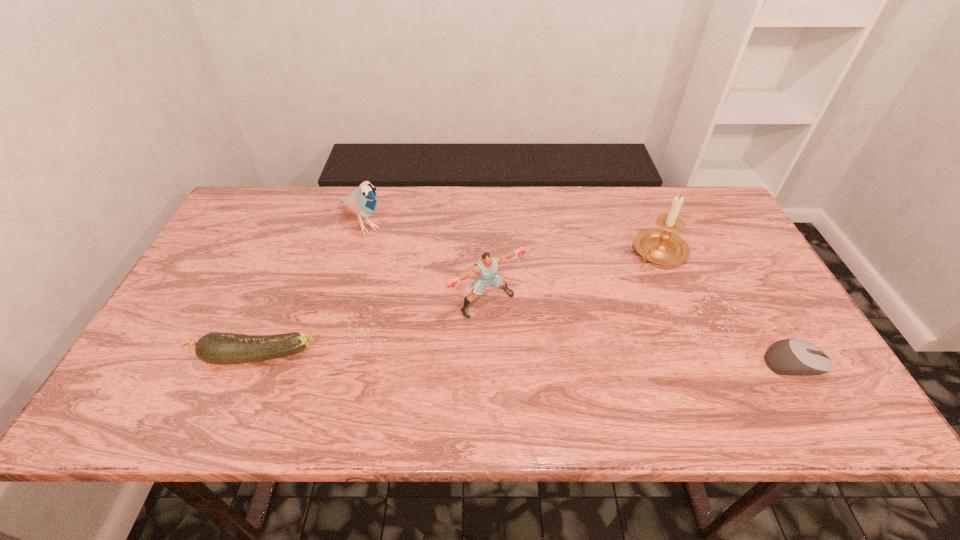
Where is `the second shortest object`? the second shortest object is located at coordinates (218, 348).

Find the location of a particular element. This screenshot has width=960, height=540. computer equipment is located at coordinates (794, 357).

Find the location of `the shortest object`. the shortest object is located at coordinates (794, 357).

Locate an element on the screen. candle holder is located at coordinates (660, 246).

In order to click on bird in this screenshot , I will do `click(362, 201)`.

The width and height of the screenshot is (960, 540). I want to click on the third farthest object, so click(486, 267).

This screenshot has width=960, height=540. Identify the location of puncher. tap(486, 267).

Where is `vacant position located at the blossom end of the zucchini`? This screenshot has width=960, height=540. vacant position located at the blossom end of the zucchini is located at coordinates (148, 357).

Locate an element on the screen. Image resolution: width=960 pixels, height=540 pixels. vacant space situated 0.140m with a handle on the side of the candle holder is located at coordinates (619, 292).

Find the location of a particular element. vacant space situated 0.190m with a handle on the side of the candle holder is located at coordinates (609, 303).